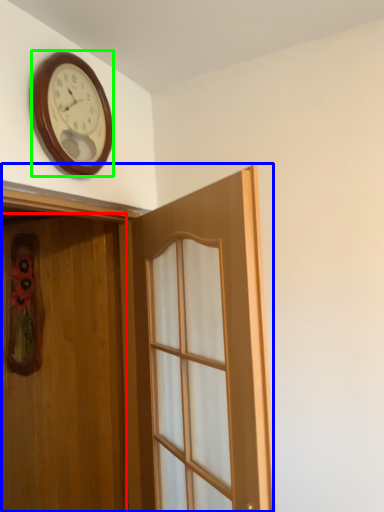
Question: Which is farther away from door (highlighted by a red box)? door (highlighted by a blue box) or wall clock (highlighted by a green box)?

Choices:
 (A) door
 (B) wall clock

Answer: (B)